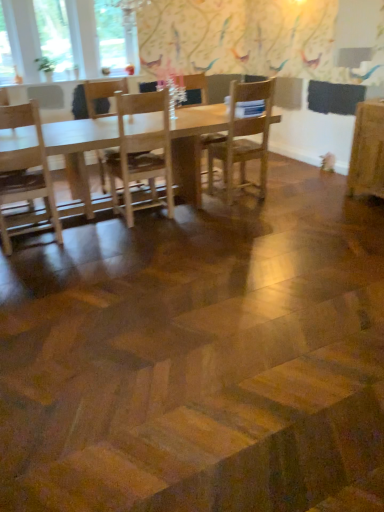
Question: Does clear glass window at upper left, acting as the second window starting from the right, have a smaller size compared to clear glass window at upper left, which appears as the 3th window when viewed from the left?

Choices:
 (A) yes
 (B) no

Answer: (A)

Question: Does clear glass window at upper left, acting as the second window starting from the right, have a lesser width compared to clear glass window at upper left, which appears as the 3th window when viewed from the left?

Choices:
 (A) no
 (B) yes

Answer: (B)

Question: Is clear glass window at upper left, the second window positioned from the left, wider than clear glass window at upper left, which appears as the 3th window when viewed from the left?

Choices:
 (A) no
 (B) yes

Answer: (A)

Question: Considering the relative positions of clear glass window at upper left, the second window positioned from the left, and clear glass window at upper left, which is the first window from right to left, in the image provided, is clear glass window at upper left, the second window positioned from the left, to the right of clear glass window at upper left, which is the first window from right to left, from the viewer's perspective?

Choices:
 (A) yes
 (B) no

Answer: (B)

Question: Is the depth of clear glass window at upper left, acting as the second window starting from the right, greater than that of clear glass window at upper left, which appears as the 3th window when viewed from the left?

Choices:
 (A) yes
 (B) no

Answer: (B)

Question: From a real-world perspective, is clear glass window at upper left, the second window positioned from the left, physically located above or below clear glass window at upper left, which is the first window from right to left?

Choices:
 (A) above
 (B) below

Answer: (B)

Question: In terms of size, does clear glass window at upper left, acting as the second window starting from the right, appear bigger or smaller than clear glass window at upper left, which appears as the 3th window when viewed from the left?

Choices:
 (A) small
 (B) big

Answer: (A)

Question: Does point [66, 72] appear closer or farther from the camera than point [132, 22]?

Choices:
 (A) farther
 (B) closer

Answer: (A)

Question: From the image's perspective, is clear glass window at upper left, the second window positioned from the left, above or below clear glass window at upper left, which is the first window from right to left?

Choices:
 (A) above
 (B) below

Answer: (B)

Question: Is point (205, 83) positioned closer to the camera than point (92, 102)?

Choices:
 (A) farther
 (B) closer

Answer: (A)

Question: Do you think wooden chair at center, the second chair viewed from the left, is within wooden chair at center, which is the 3th chair in right-to-left order, or outside of it?

Choices:
 (A) inside
 (B) outside

Answer: (B)

Question: Relative to wooden chair at center, which is the 3th chair in right-to-left order, is wooden chair at center, the second chair viewed from the left, in front or behind?

Choices:
 (A) front
 (B) behind

Answer: (B)

Question: Based on their sizes in the image, would you say wooden chair at center, the second chair viewed from the left, is bigger or smaller than wooden chair at center, which is the 3th chair in right-to-left order?

Choices:
 (A) big
 (B) small

Answer: (A)

Question: Considering the positions of wooden chair at center, the second chair viewed from the left, and clear glass window at upper left, which appears as the 3th window when viewed from the left, in the image, is wooden chair at center, the second chair viewed from the left, wider or thinner than clear glass window at upper left, which appears as the 3th window when viewed from the left,?

Choices:
 (A) thin
 (B) wide

Answer: (B)

Question: From the image's perspective, relative to clear glass window at upper left, which appears as the 3th window when viewed from the left, is wooden chair at center, the second chair viewed from the left, above or below?

Choices:
 (A) above
 (B) below

Answer: (B)